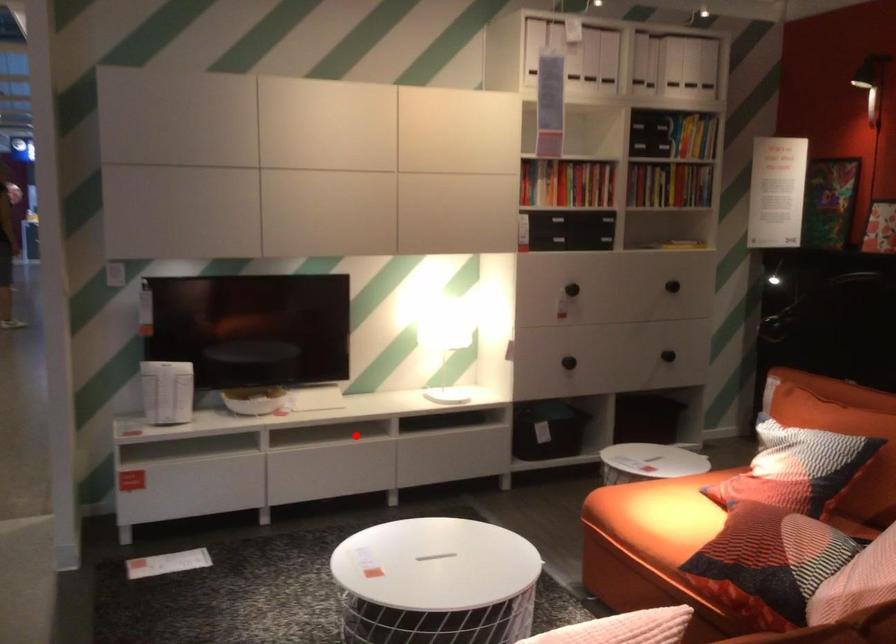
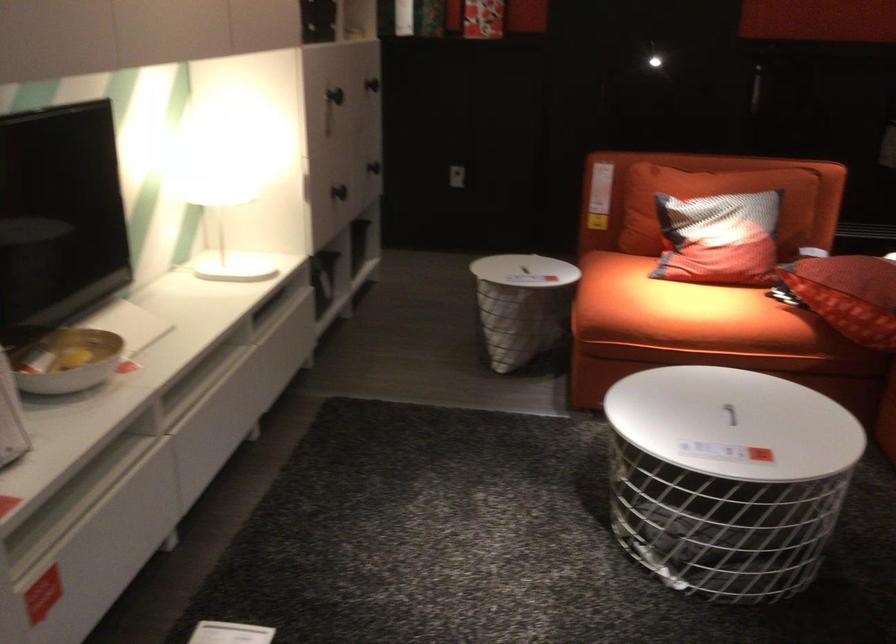
Find the pixel in the second image that matches the highlighted location in the first image.

(200, 381)